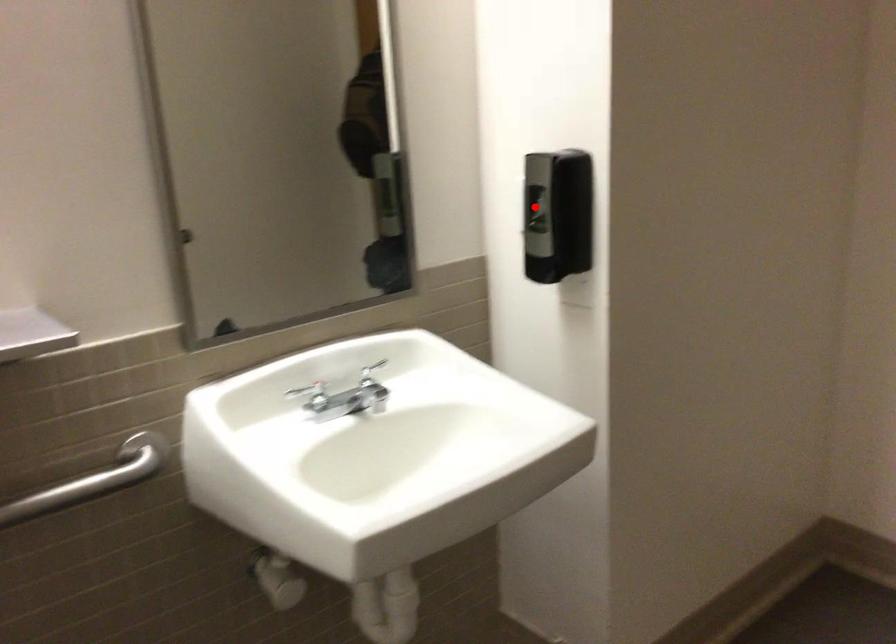
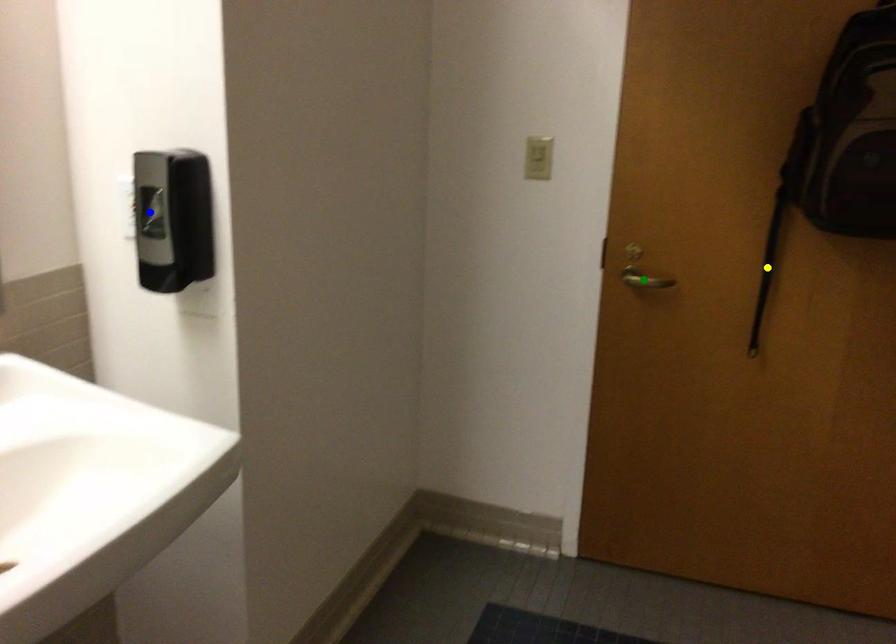
Question: I am providing you with two images of the same scene from different viewpoints. A red point is marked on the first image. You are given multiple points on the second image. Which spot in image 2 lines up with the point in image 1?

Choices:
 (A) yellow point
 (B) blue point
 (C) green point

Answer: (B)